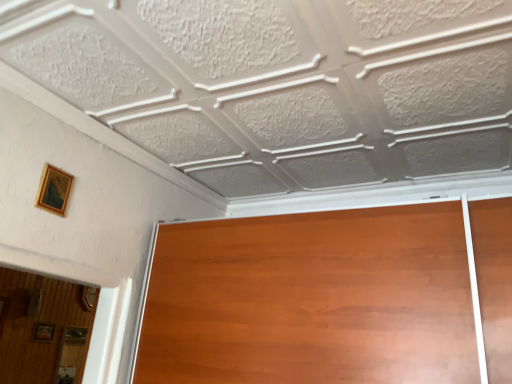
Question: In the image, is gold wooden picture frame at upper left, the second picture frame when ordered from bottom to top, on the left side or the right side of wooden picture frame at lower left, which is the first picture frame in bottom-to-top order?

Choices:
 (A) left
 (B) right

Answer: (B)

Question: From the image's perspective, is gold wooden picture frame at upper left, the 2th picture frame when ordered from back to front, above or below wooden picture frame at lower left, the first picture frame positioned from the back?

Choices:
 (A) above
 (B) below

Answer: (A)

Question: From a real-world perspective, relative to wooden picture frame at lower left, the 2th picture frame in the front-to-back sequence, is gold wooden picture frame at upper left, the 2th picture frame when ordered from back to front, vertically above or below?

Choices:
 (A) below
 (B) above

Answer: (B)

Question: Considering the positions of wooden picture frame at lower left, the 1th picture frame when ordered from left to right, and gold wooden picture frame at upper left, placed as the first picture frame when sorted from right to left, in the image, is wooden picture frame at lower left, the 1th picture frame when ordered from left to right, bigger or smaller than gold wooden picture frame at upper left, placed as the first picture frame when sorted from right to left,?

Choices:
 (A) small
 (B) big

Answer: (B)

Question: Considering their positions, is wooden picture frame at lower left, which is the first picture frame in bottom-to-top order, located in front of or behind gold wooden picture frame at upper left, the 2th picture frame when ordered from back to front?

Choices:
 (A) front
 (B) behind

Answer: (B)

Question: Is wooden picture frame at lower left, which is the first picture frame in bottom-to-top order, taller or shorter than gold wooden picture frame at upper left, the second picture frame when ordered from bottom to top?

Choices:
 (A) tall
 (B) short

Answer: (B)

Question: Considering the positions of point (40, 336) and point (40, 190), is point (40, 336) closer or farther from the camera than point (40, 190)?

Choices:
 (A) closer
 (B) farther

Answer: (B)